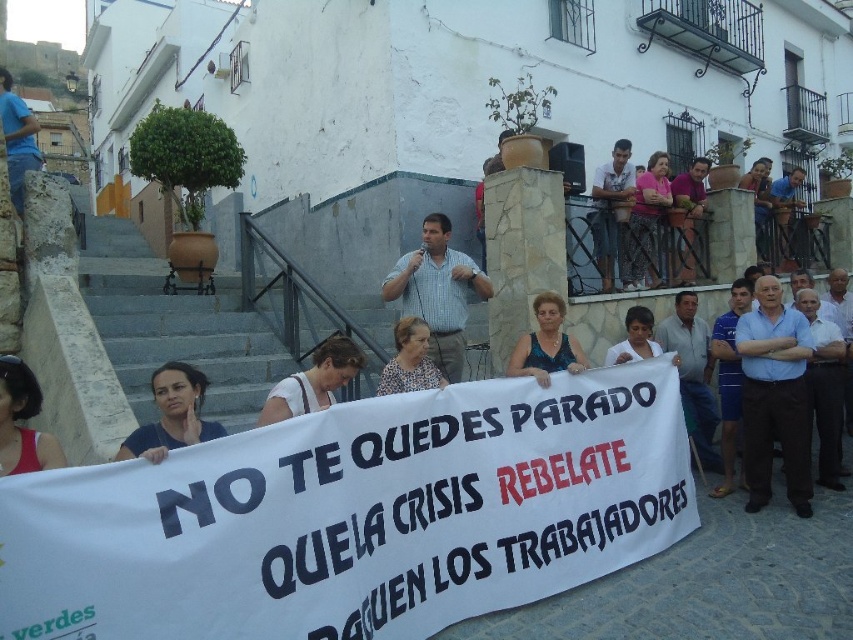
Question: Can you confirm if blue shirt at center is smaller than blue fabric at center?

Choices:
 (A) yes
 (B) no

Answer: (B)

Question: Does checkered fabric shirt at center appear on the left side of blue fabric at center?

Choices:
 (A) no
 (B) yes

Answer: (B)

Question: Is white fabric at center thinner than light brown shirt at upper right?

Choices:
 (A) yes
 (B) no

Answer: (A)

Question: Based on their relative distances, which object is farther from the matte floral blouse at center?

Choices:
 (A) light brown shirt at upper right
 (B) matte blue shirt at lower left

Answer: (A)

Question: Among these points, which one is nearest to the camera?

Choices:
 (A) (451, 250)
 (B) (160, 428)

Answer: (B)

Question: Which point is farther to the camera?

Choices:
 (A) blue shirt at center
 (B) checkered fabric shirt at center
 (C) blue fabric at center

Answer: (B)